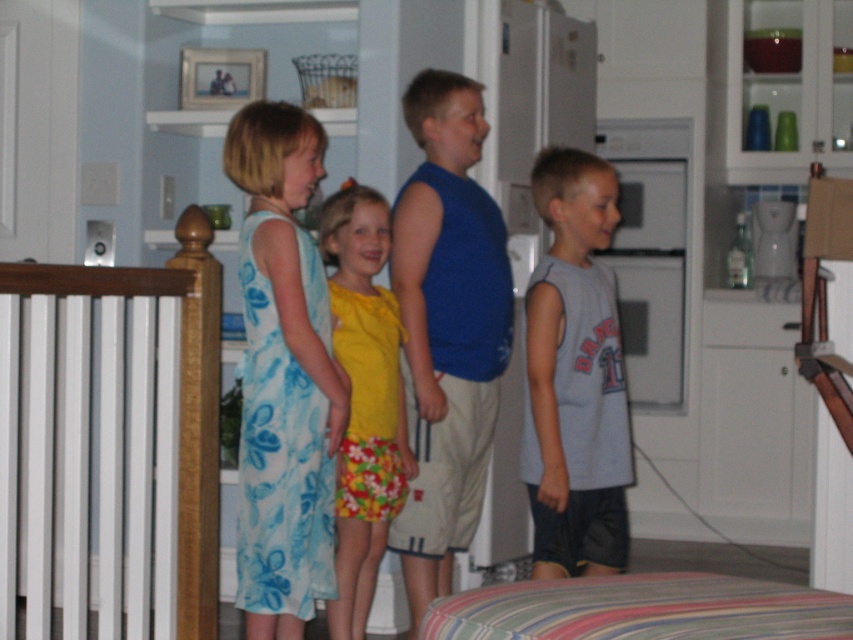
You are observing the scene from the front. There are two points labeled as point (463, 176) and point (558, 257). Which point is closer to you?

Point (463, 176) is closer to you because it is further to the camera than point (558, 257).

You are a photographer trying to capture a clear shot of both point (x=144, y=520) and point (x=482, y=316) in the image. Since you want both points to be in focus, which point should you adjust your camera focus to prioritize?

You should prioritize focusing on point (x=482, y=316) because it is farther from the camera than point (x=144, y=520). By focusing on the farther point, the closer point will also be within the depth of field, ensuring both are in focus.